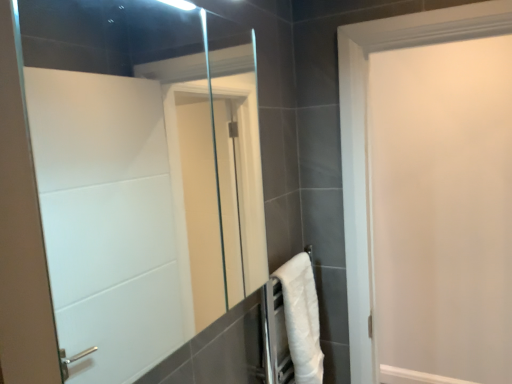
Question: From the image's perspective, is white soft towel at lower right below white matte door at upper right?

Choices:
 (A) yes
 (B) no

Answer: (A)

Question: Is white soft towel at lower right beside white matte door at upper right?

Choices:
 (A) no
 (B) yes

Answer: (A)

Question: From the image's perspective, is white soft towel at lower right above white matte door at upper right?

Choices:
 (A) yes
 (B) no

Answer: (B)

Question: Is white soft towel at lower right turned away from white matte door at upper right?

Choices:
 (A) yes
 (B) no

Answer: (B)

Question: Can you confirm if white soft towel at lower right is smaller than white matte door at upper right?

Choices:
 (A) yes
 (B) no

Answer: (A)

Question: Is white soft towel at lower right aimed at white matte door at upper right?

Choices:
 (A) yes
 (B) no

Answer: (B)

Question: Does white soft towel at lower right have a smaller size compared to clear glass mirror at center?

Choices:
 (A) no
 (B) yes

Answer: (B)

Question: Is clear glass mirror at center located within white soft towel at lower right?

Choices:
 (A) yes
 (B) no

Answer: (B)

Question: From the image's perspective, is white soft towel at lower right below clear glass mirror at center?

Choices:
 (A) no
 (B) yes

Answer: (B)

Question: Is white soft towel at lower right at the left side of clear glass mirror at center?

Choices:
 (A) yes
 (B) no

Answer: (B)

Question: Is white soft towel at lower right taller than clear glass mirror at center?

Choices:
 (A) yes
 (B) no

Answer: (B)

Question: Considering the relative sizes of white soft towel at lower right and clear glass mirror at center in the image provided, is white soft towel at lower right shorter than clear glass mirror at center?

Choices:
 (A) no
 (B) yes

Answer: (B)

Question: From a real-world perspective, is clear glass mirror at center on white matte door at upper right?

Choices:
 (A) no
 (B) yes

Answer: (B)